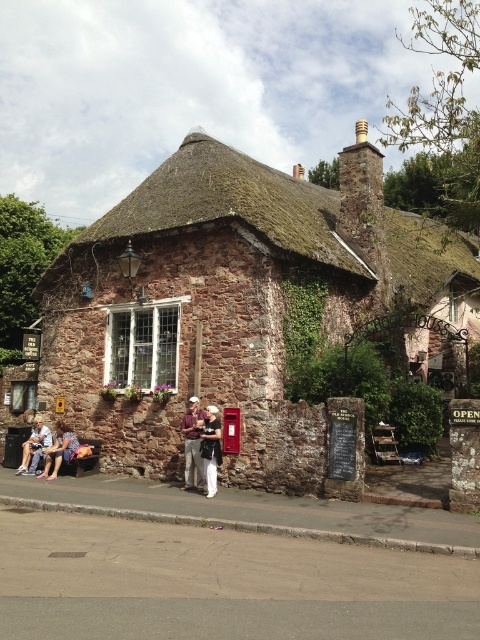
Can you confirm if rustic stone cottage at center is bigger than denim shorts at lower left?

Yes.

Does point (256, 339) lie behind point (62, 449)?

No, it is in front of (62, 449).

This screenshot has height=640, width=480. I want to click on rustic stone cottage at center, so click(x=226, y=305).

Can you confirm if rustic stone cottage at center is wider than white cotton shirt at center?

Correct, the width of rustic stone cottage at center exceeds that of white cotton shirt at center.

Can you confirm if rustic stone cottage at center is smaller than white cotton shirt at center?

No.

Does point (175, 289) come closer to viewer compared to point (203, 445)?

That is False.

This screenshot has height=640, width=480. Identify the location of rustic stone cottage at center. (226, 305).

The width and height of the screenshot is (480, 640). In order to click on denim shorts at lower left in this screenshot , I will do `click(59, 451)`.

Does denim shorts at lower left appear under denim jacket at lower left?

No, denim shorts at lower left is not below denim jacket at lower left.

Identify the location of denim shorts at lower left. (59, 451).